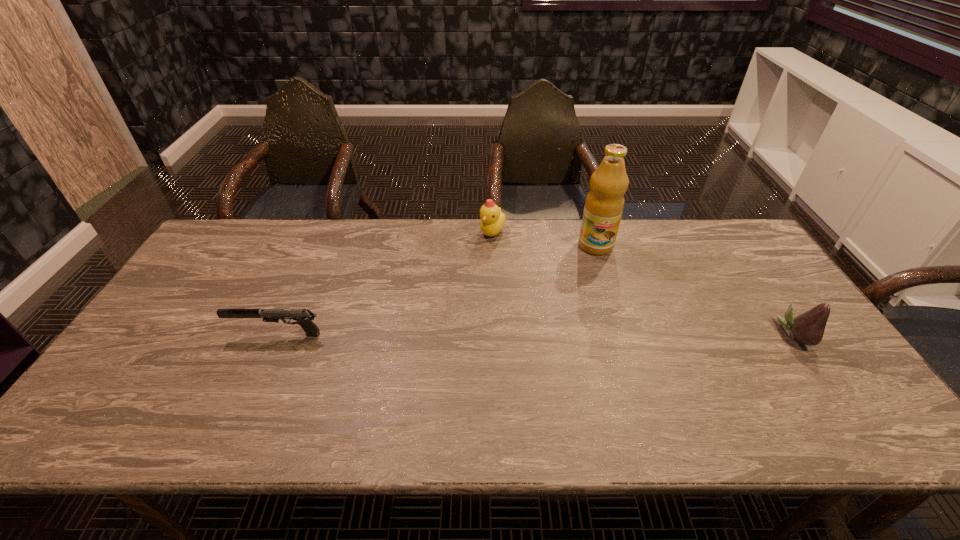
Where is `blank space located 0.390m on the front-facing side of the third object from right to left`? This screenshot has width=960, height=540. blank space located 0.390m on the front-facing side of the third object from right to left is located at coordinates coord(474,332).

At what (x,y) coordinates should I click in order to perform the action: click on vacant space located 0.370m on the front-facing side of the third object from right to left. Please return your answer as a coordinate pair (x, y). Looking at the image, I should click on (475, 326).

Where is `vacant area located on the label of the tallest object`? Image resolution: width=960 pixels, height=540 pixels. vacant area located on the label of the tallest object is located at coordinates (609, 335).

The width and height of the screenshot is (960, 540). Identify the location of vacant space located on the label of the tallest object. (599, 271).

Find the location of `vacant space situated 0.070m on the label of the tallest object`. vacant space situated 0.070m on the label of the tallest object is located at coordinates (599, 271).

Where is `duckling located at the far edge`? duckling located at the far edge is located at coordinates (492, 219).

Where is `olive oil located in the far edge section of the desktop`? The image size is (960, 540). olive oil located in the far edge section of the desktop is located at coordinates (604, 204).

Identify the location of object at the right edge. (808, 328).

Identify the location of vacant region at the far edge. (385, 255).

Identify the location of vacant region at the near edge of the desktop. The height and width of the screenshot is (540, 960). (250, 390).